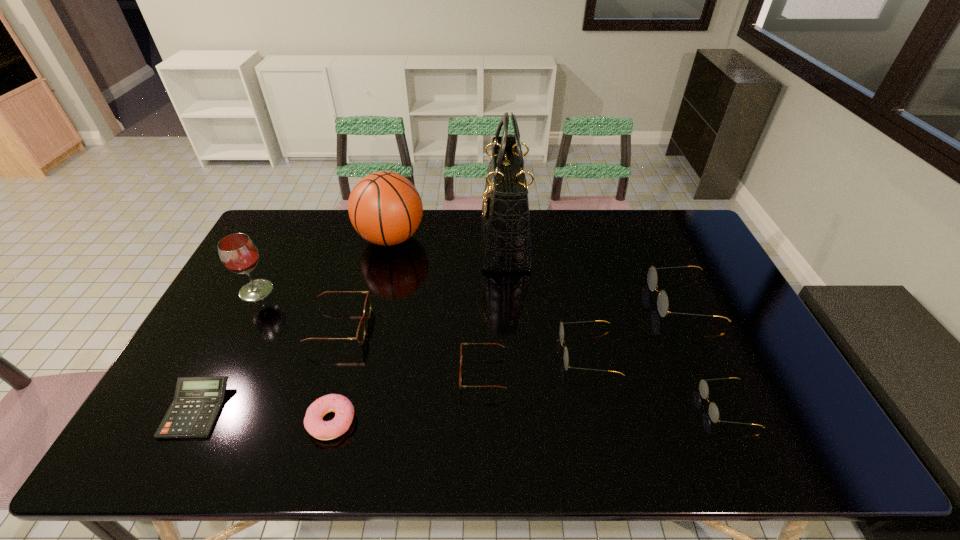
The width and height of the screenshot is (960, 540). I want to click on blank space located on the temples of the biggest gold spectacles, so click(547, 300).

The height and width of the screenshot is (540, 960). Identify the location of vacant region located 0.240m on the temples of the biggest gold spectacles. (573, 300).

The height and width of the screenshot is (540, 960). I want to click on vacant point located on the temples of the biggest gold spectacles, so point(534,300).

I want to click on vacant space located at the front view of the bigger brown spectacles, so click(398, 327).

The width and height of the screenshot is (960, 540). Find the location of `vacant space located 0.120m on the temples of the third spectacles from right to left`. vacant space located 0.120m on the temples of the third spectacles from right to left is located at coordinates (516, 353).

I want to click on vacant space located on the temples of the third spectacles from right to left, so (x=513, y=353).

What are the coordinates of `vacant space situated on the temples of the third spectacles from right to left` in the screenshot? It's located at (421, 353).

Image resolution: width=960 pixels, height=540 pixels. In order to click on free space located 0.150m at the front view of the right brown spectacles in this screenshot , I will do `click(404, 374)`.

This screenshot has height=540, width=960. I want to click on vacant space located 0.380m at the front view of the right brown spectacles, so click(317, 374).

The width and height of the screenshot is (960, 540). I want to click on vacant area located at the front view of the right brown spectacles, so click(343, 374).